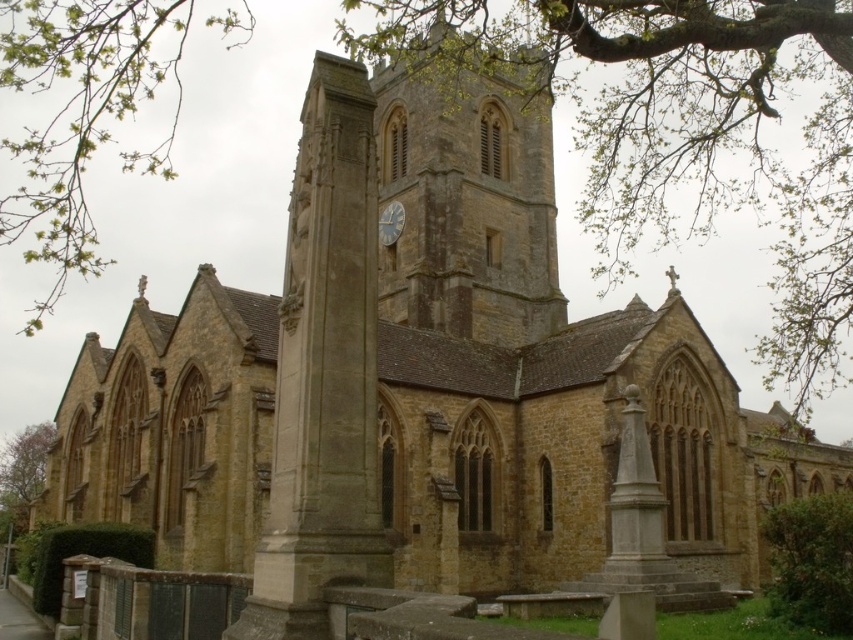
Question: Does green leafy branches at upper center have a greater width compared to brown stone clock tower at center?

Choices:
 (A) no
 (B) yes

Answer: (B)

Question: Is brown stone clock tower at center positioned at the back of white painted wood clock at center?

Choices:
 (A) yes
 (B) no

Answer: (B)

Question: Which object is the farthest from the green leafy branches at upper center?

Choices:
 (A) green leafy bush at lower right
 (B) brown stone clock tower at center
 (C) white painted wood clock at center

Answer: (A)

Question: Which point is farther to the camera?

Choices:
 (A) (9, 461)
 (B) (827, 582)
 (C) (395, 212)

Answer: (A)

Question: Does brown stone clock tower at center have a lesser width compared to green leafy bush at lower right?

Choices:
 (A) no
 (B) yes

Answer: (A)

Question: Which of the following is the closest to the observer?

Choices:
 (A) (100, 58)
 (B) (346, 6)
 (C) (846, 611)
 (D) (39, 472)

Answer: (C)